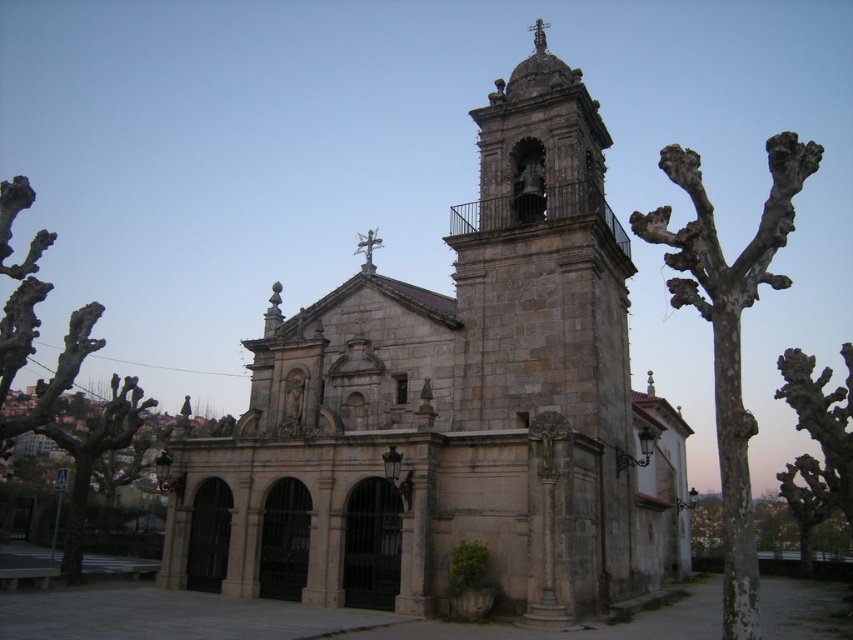
You are standing in front of the historic stone church and want to take a photo of the polished stone cross at center. However, there is a bark textured tree at right in the way. Based on their positions, can you still capture the cross in your shot without the tree blocking it?

The bark textured tree at right is located below the polished stone cross at center, so the cross is above the tree and should be visible in the photo without obstruction.